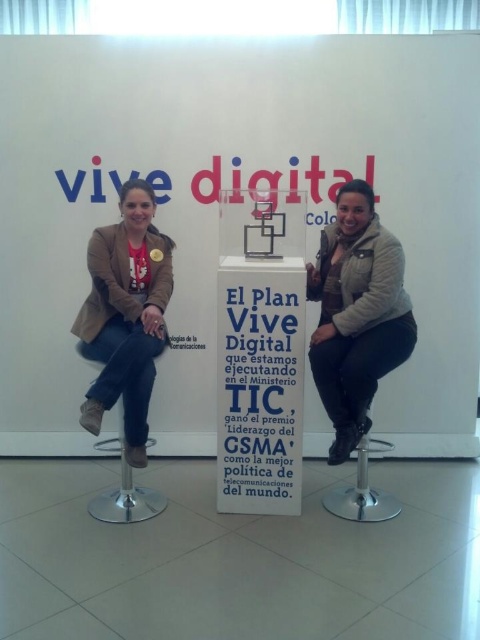
Question: Is matte beige jacket at center behind gold metallic medal at center?

Choices:
 (A) yes
 (B) no

Answer: (B)

Question: Can you confirm if matte beige jacket at center is wider than metallic silver bar stool at left?

Choices:
 (A) no
 (B) yes

Answer: (B)

Question: Which object is closer to the camera taking this photo?

Choices:
 (A) matte beige jacket at center
 (B) matte beige jacket at left
 (C) gold metallic medal at center
 (D) metallic silver bar stool at left

Answer: (B)

Question: Which object appears closest to the camera in this image?

Choices:
 (A) matte beige jacket at center
 (B) metallic silver bar stool at left
 (C) matte beige jacket at left
 (D) gold metallic medal at center

Answer: (C)

Question: Considering the real-world distances, which object is closest to the metallic silver bar stool at lower center?

Choices:
 (A) metallic silver bar stool at left
 (B) matte beige jacket at center
 (C) gold metallic medal at center

Answer: (B)

Question: Observing the image, what is the correct spatial positioning of matte beige jacket at center in reference to matte beige jacket at left?

Choices:
 (A) below
 (B) above

Answer: (A)